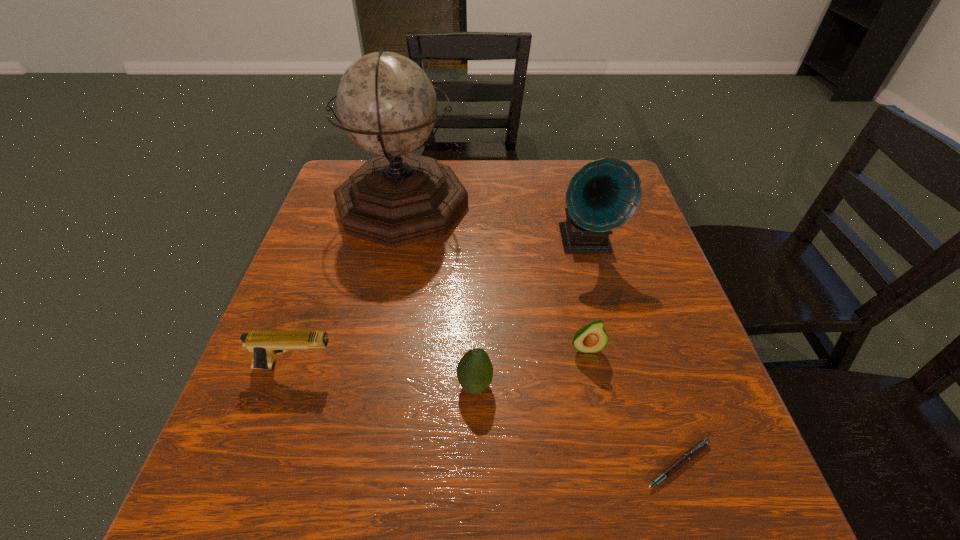
Where is `the tallest object`? The image size is (960, 540). the tallest object is located at coordinates (386, 103).

Where is `phonograph_record`? phonograph_record is located at coordinates (604, 194).

Where is `pistol`? This screenshot has width=960, height=540. pistol is located at coordinates (263, 345).

Identify the location of the left avocado. (474, 371).

Where is `the third farthest object`? the third farthest object is located at coordinates (592, 338).

Image resolution: width=960 pixels, height=540 pixels. Find the location of `the right avocado`. the right avocado is located at coordinates (592, 338).

You are a GUI agent. You are given a task and a screenshot of the screen. Output one action in this format:
    pyautogui.click(x=<x>, y=<y>)
    Task: Click on the nearest object
    
    Given the screenshot: What is the action you would take?
    [692, 452]

Where is `pen`? The image size is (960, 540). pen is located at coordinates (692, 452).

Find the location of `vacant point located on the surface of the tallest object`. vacant point located on the surface of the tallest object is located at coordinates (554, 205).

Where is `vacant space located 0.240m from the horn of the phonograph_record`? This screenshot has width=960, height=540. vacant space located 0.240m from the horn of the phonograph_record is located at coordinates (614, 353).